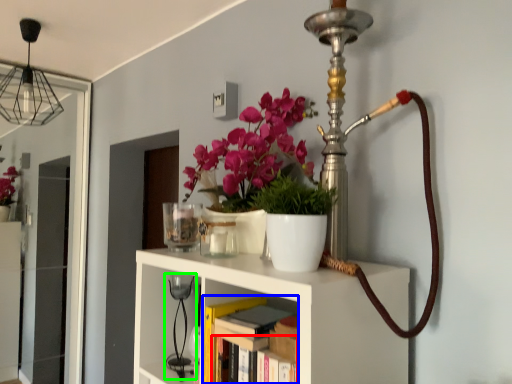
Question: Considering the real-world distances, which object is closest to book (highlighted by a red box)? book (highlighted by a blue box) or table lamp (highlighted by a green box).

Choices:
 (A) book
 (B) table lamp

Answer: (A)